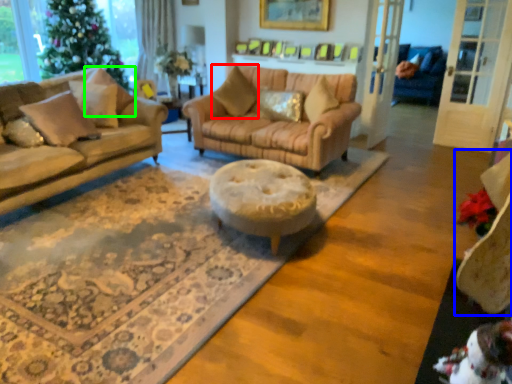
Question: Which is farther away from pillow (highlighted by a red box)? swivel chair (highlighted by a blue box) or pillow (highlighted by a green box)?

Choices:
 (A) swivel chair
 (B) pillow

Answer: (A)